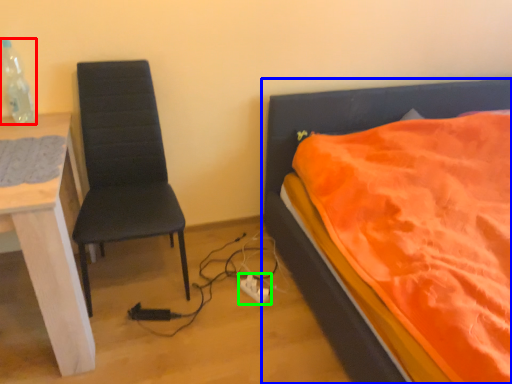
Question: Which object is positioned closest to bottle (highlighted by a red box)? Select from bed (highlighted by a blue box) and power plugs and sockets (highlighted by a green box).

Choices:
 (A) bed
 (B) power plugs and sockets

Answer: (B)